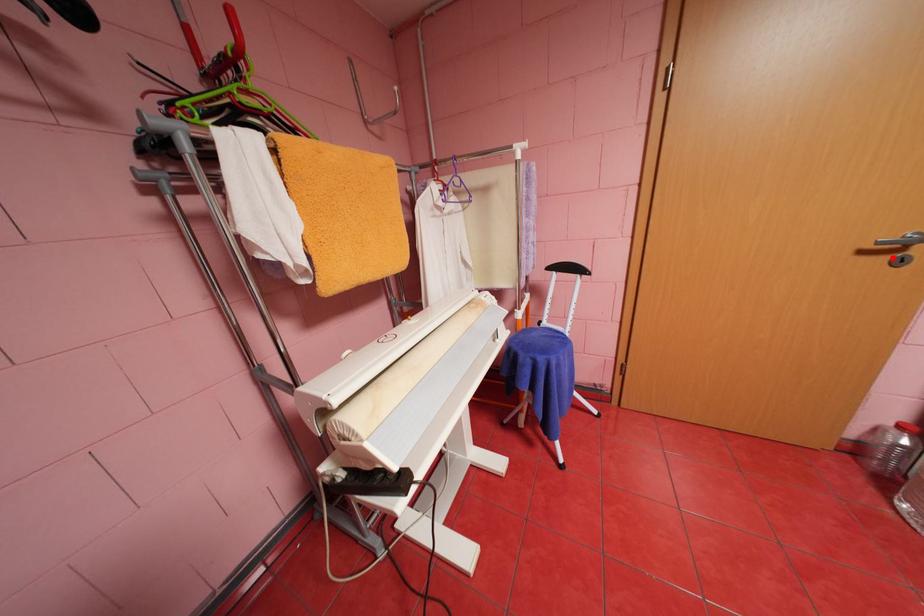
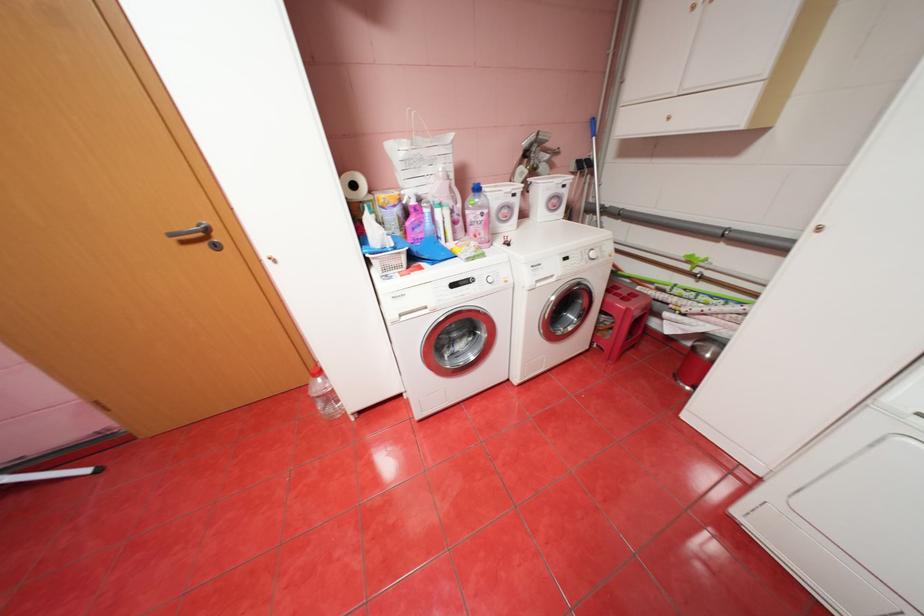
Find the pixel in the second image that matches the highlighted location in the first image.

(213, 245)